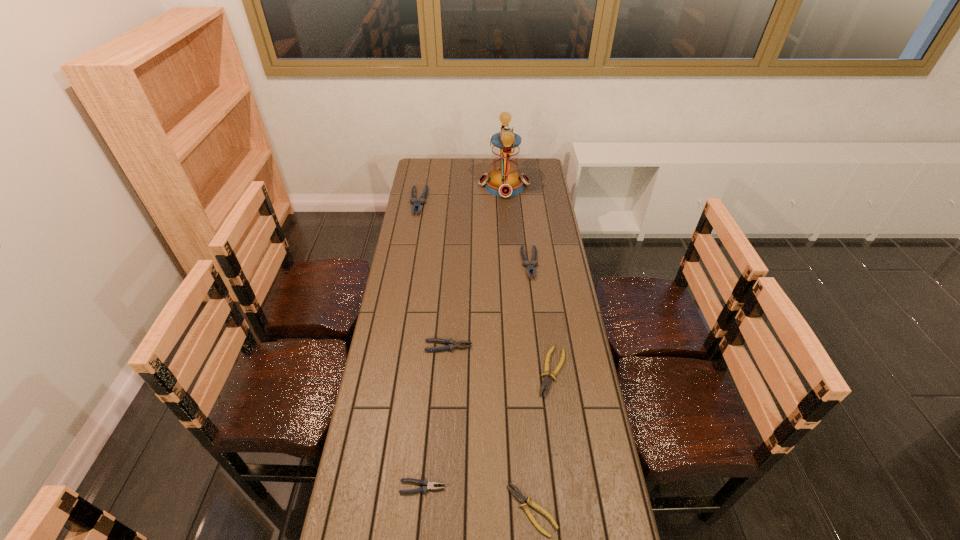
You are a GUI agent. You are given a task and a screenshot of the screen. Output one action in this format:
    pyautogui.click(x=<x>, y=<y>)
    Task: Click on the shortest pliers
    
    Given the screenshot: What is the action you would take?
    coord(519,496)

Find the location of `vacant position located 0.130m on the front-facing side of the lantern`. vacant position located 0.130m on the front-facing side of the lantern is located at coordinates (454, 185).

Where is `vacant area situated 0.230m on the front-facing side of the lantern`? vacant area situated 0.230m on the front-facing side of the lantern is located at coordinates (435, 185).

The width and height of the screenshot is (960, 540). I want to click on vacant space located 0.150m on the front-facing side of the lantern, so click(450, 185).

I want to click on vacant space located 0.290m at the gripping part of the tallest pliers, so click(x=409, y=256).

The height and width of the screenshot is (540, 960). In order to click on free space located at the gripping part of the rightmost gray pliers in this screenshot , I will do `click(539, 341)`.

Where is `vacant region located 0.150m at the gripping part of the fourth shortest pliers`? The image size is (960, 540). vacant region located 0.150m at the gripping part of the fourth shortest pliers is located at coordinates (514, 347).

Identify the location of vacant space located 0.060m on the right of the farther yellow pliers. Image resolution: width=960 pixels, height=540 pixels. (586, 372).

Where is `free location located 0.070m at the gripping part of the smallest gray pliers`? This screenshot has height=540, width=960. free location located 0.070m at the gripping part of the smallest gray pliers is located at coordinates (470, 487).

You are a GUI agent. You are given a task and a screenshot of the screen. Output one action in this format:
    pyautogui.click(x=<x>, y=<y>)
    Task: Click on the vacant space situated on the right of the shortest object
    
    Given the screenshot: What is the action you would take?
    pyautogui.click(x=597, y=510)